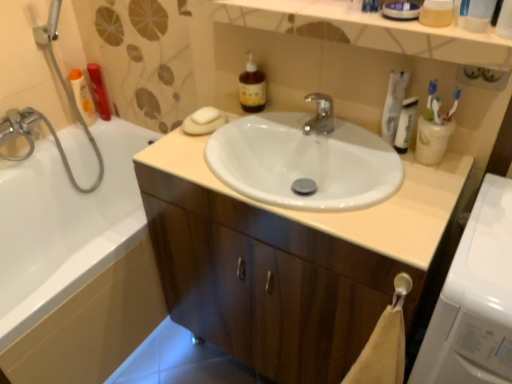
At what (x,y) coordinates should I click in order to perform the action: click on vacant space in front of white matte soap at upper center. Please return your answer as a coordinate pair (x, y). The height and width of the screenshot is (384, 512). Looking at the image, I should click on (194, 155).